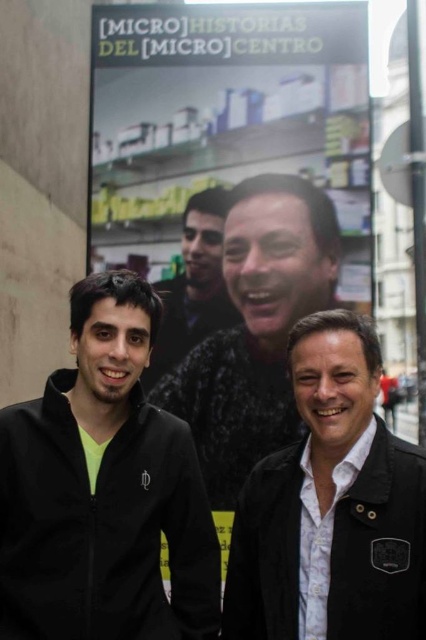
Question: Among these points, which one is farthest from the camera?

Choices:
 (A) (195, 342)
 (B) (362, 284)
 (C) (258, 518)

Answer: (A)

Question: Which point appears farthest from the camera in this image?

Choices:
 (A) (152, 353)
 (B) (154, 120)

Answer: (A)

Question: Is matte plastic poster at upper center to the left of matte black jacket at center from the viewer's perspective?

Choices:
 (A) no
 (B) yes

Answer: (B)

Question: Estimate the real-world distances between objects in this image. Which object is closer to the matte plastic poster at upper center?

Choices:
 (A) smooth black jacket at center
 (B) black matte jacket at left
 (C) matte black jacket at center
 (D) black leather jacket at center

Answer: (A)

Question: Does matte plastic poster at upper center appear under black leather jacket at center?

Choices:
 (A) yes
 (B) no

Answer: (B)

Question: Can you confirm if matte black jacket at center is thinner than smooth black jacket at center?

Choices:
 (A) no
 (B) yes

Answer: (A)